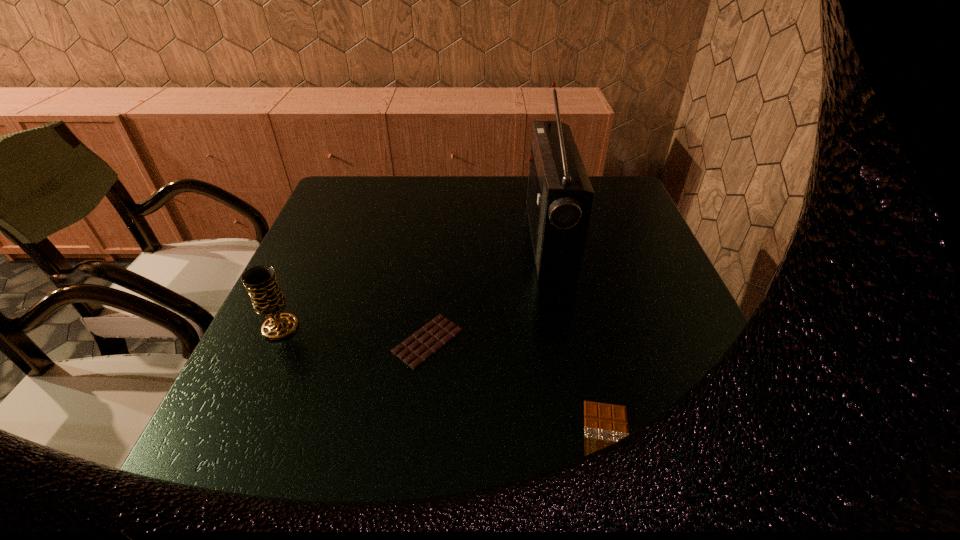
You are a GUI agent. You are given a task and a screenshot of the screen. Output one action in this format:
    pyautogui.click(x=<x>, y=<y>)
    Task: Click on the blank area at the right edge
    
    Given the screenshot: What is the action you would take?
    pyautogui.click(x=612, y=255)

Where is `free space at the far right corner of the desktop`? This screenshot has width=960, height=540. free space at the far right corner of the desktop is located at coordinates (604, 208).

Identify the location of vacant point at the near right corner. pos(717,476).

Find the location of `empty space that is in between the chalice and the taller chocolate bar`. empty space that is in between the chalice and the taller chocolate bar is located at coordinates (354, 334).

Image resolution: width=960 pixels, height=540 pixels. I want to click on free space between the taller chocolate bar and the radio receiver, so click(489, 291).

Locate an element on the screen. The image size is (960, 540). free space that is in between the nearer chocolate bar and the second object from left to right is located at coordinates (517, 395).

Identify the location of vacant space that's between the farthest object and the third shortest object. The width and height of the screenshot is (960, 540). (415, 284).

Locate an element on the screen. free space between the shortest object and the second shortest object is located at coordinates (517, 395).

The height and width of the screenshot is (540, 960). I want to click on free space between the taller chocolate bar and the farthest object, so click(489, 291).

You are a GUI agent. You are given a task and a screenshot of the screen. Output one action in this format:
    pyautogui.click(x=<x>, y=<y>)
    Task: Click on the vacant point located between the shorter chocolate bar and the radio receiver
    Image resolution: width=960 pixels, height=540 pixels.
    Given the screenshot: What is the action you would take?
    pyautogui.click(x=578, y=344)